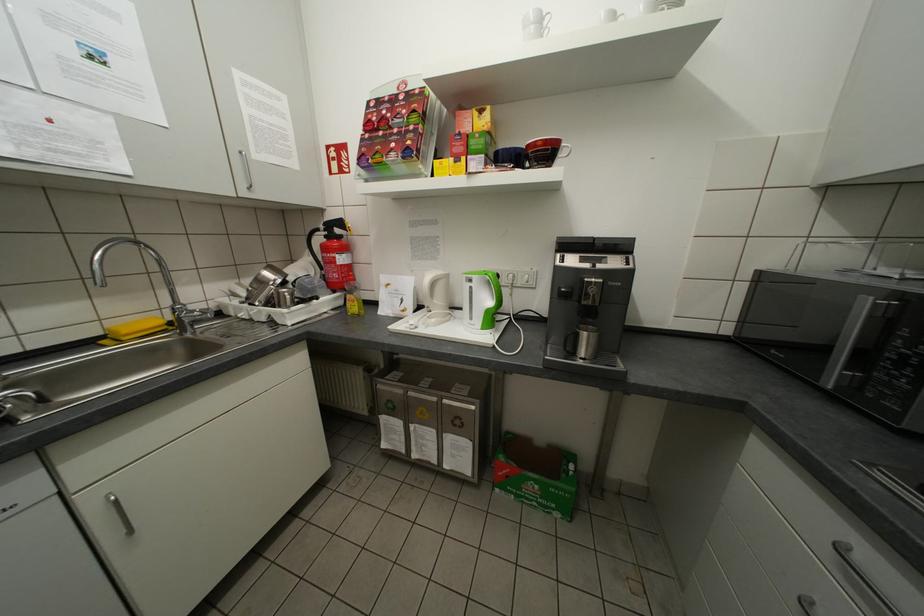
Where is `microwave door handle`? microwave door handle is located at coordinates (852, 336).